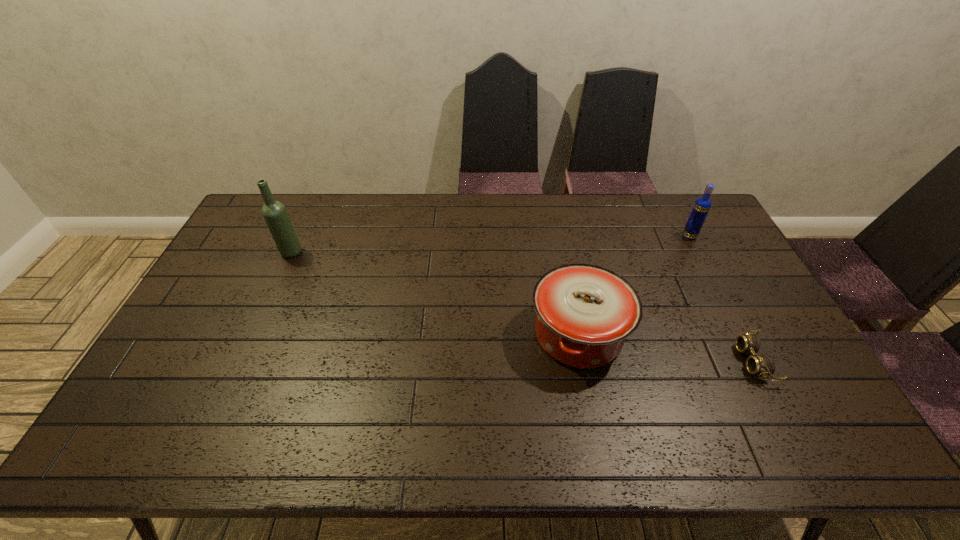
This screenshot has height=540, width=960. In order to click on the leftmost object in this screenshot , I will do `click(275, 214)`.

Find the location of `the third nearest object`. the third nearest object is located at coordinates (275, 214).

This screenshot has width=960, height=540. Identify the location of vodka. (702, 205).

The height and width of the screenshot is (540, 960). What are the coordinates of `the third object from right to left` in the screenshot? It's located at (585, 312).

You are a GUI agent. You are given a task and a screenshot of the screen. Output one action in this format:
    pyautogui.click(x=<x>, y=<y>)
    Task: Click on the casserole
    This screenshot has height=540, width=960.
    Given the screenshot: What is the action you would take?
    pyautogui.click(x=585, y=312)

Locate an element on the screen. the shortest object is located at coordinates (762, 365).

This screenshot has height=540, width=960. Find the location of `vacant space located on the back of the tallest object`. vacant space located on the back of the tallest object is located at coordinates (313, 202).

Find the location of a particular element. This screenshot has height=540, width=960. vacant point located 0.140m on the front of the farthest object is located at coordinates (707, 268).

Where is `vacant space located 0.120m on the back of the casserole`? The width and height of the screenshot is (960, 540). vacant space located 0.120m on the back of the casserole is located at coordinates (565, 268).

Where is `vacant space located 0.210m through the lenses of the goggles`? Image resolution: width=960 pixels, height=540 pixels. vacant space located 0.210m through the lenses of the goggles is located at coordinates (661, 361).